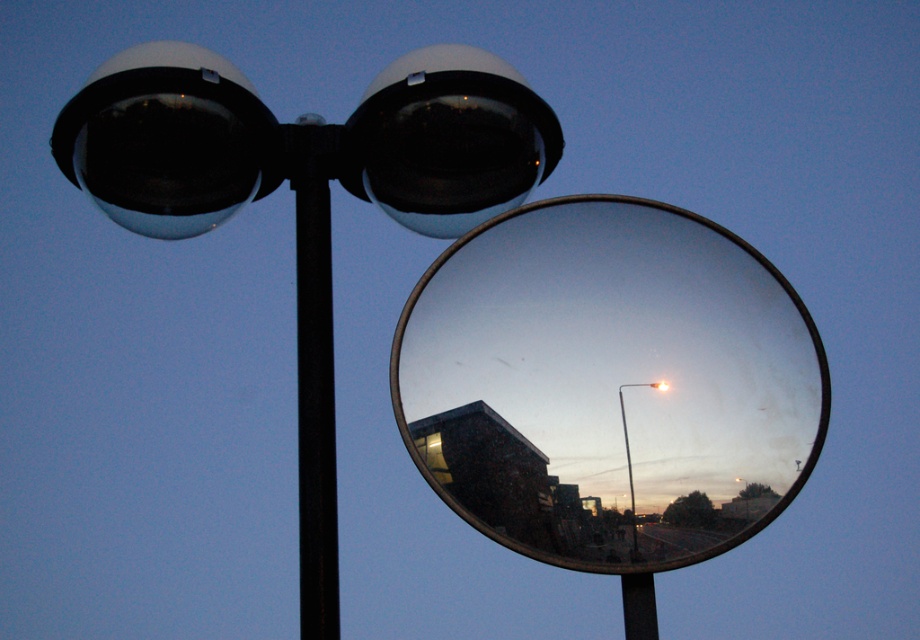
Does matte black lamp post at upper center appear on the left side of metallic silver pole at center?

Indeed, matte black lamp post at upper center is positioned on the left side of metallic silver pole at center.

This screenshot has width=920, height=640. Describe the element at coordinates (306, 195) in the screenshot. I see `matte black lamp post at upper center` at that location.

Identify the location of matte black lamp post at upper center. Image resolution: width=920 pixels, height=640 pixels. (306, 195).

What do you see at coordinates (315, 371) in the screenshot? I see `black metal pole at center` at bounding box center [315, 371].

Between black metal pole at center and metallic silver pole at center, which one is positioned lower?

Positioned lower is metallic silver pole at center.

Is point (331, 586) positioned before point (623, 440)?

That is True.

Where is `black metal pole at center`? The width and height of the screenshot is (920, 640). black metal pole at center is located at coordinates (315, 371).

The height and width of the screenshot is (640, 920). I want to click on matte black lamp post at upper center, so pos(306,195).

You are a GUI agent. You are given a task and a screenshot of the screen. Output one action in this format:
    pyautogui.click(x=<x>, y=<y>)
    Task: Click on the matte black lamp post at upper center
    Image resolution: width=920 pixels, height=640 pixels.
    Given the screenshot: What is the action you would take?
    pyautogui.click(x=306, y=195)